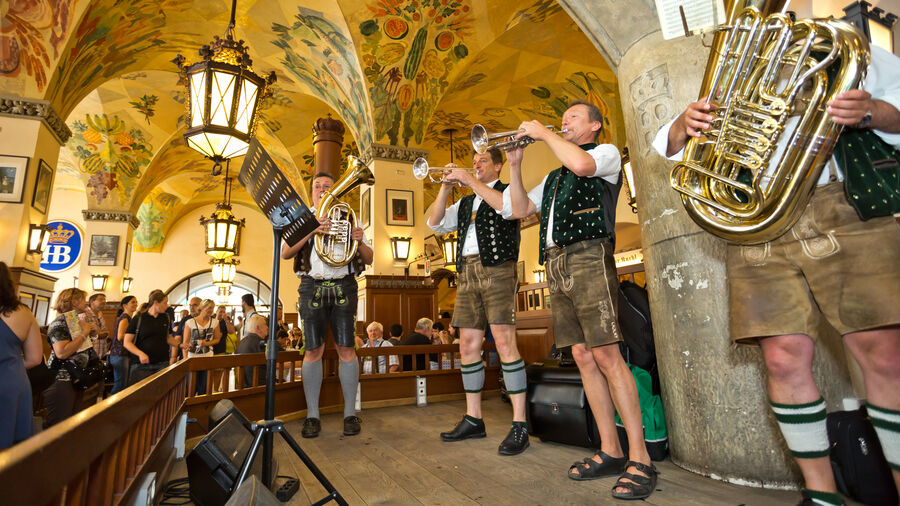
Image resolution: width=900 pixels, height=506 pixels. What are the coordinates of `hanging light` in the screenshot? It's located at (447, 249), (631, 188), (236, 114), (227, 234), (223, 271), (223, 292).